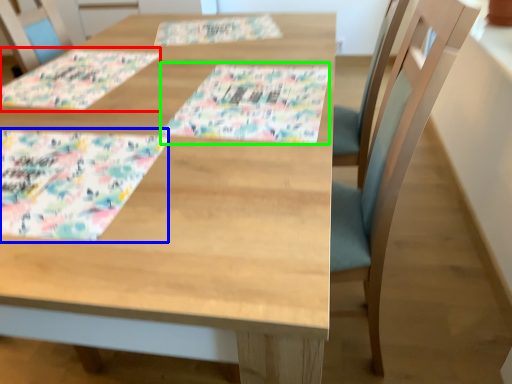
Question: Which is farther away from place mat (highlighted by a red box)? place mat (highlighted by a blue box) or tablecloth (highlighted by a green box)?

Choices:
 (A) place mat
 (B) tablecloth

Answer: (B)